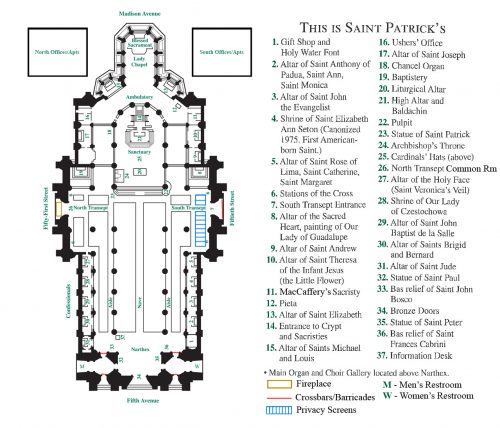
I want to click on entrances, so click(216, 207).